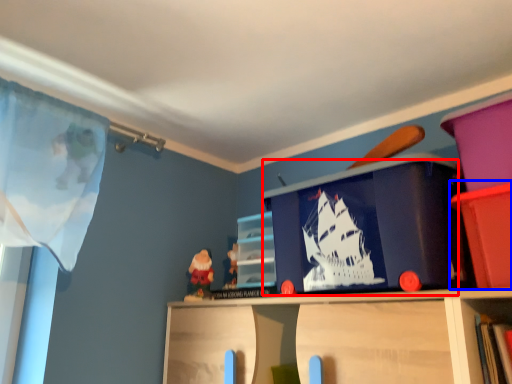
Question: Which object appears closest to the camera in this image, window screen (highlighted by a red box) or cabinet (highlighted by a blue box)?

Choices:
 (A) window screen
 (B) cabinet

Answer: (B)